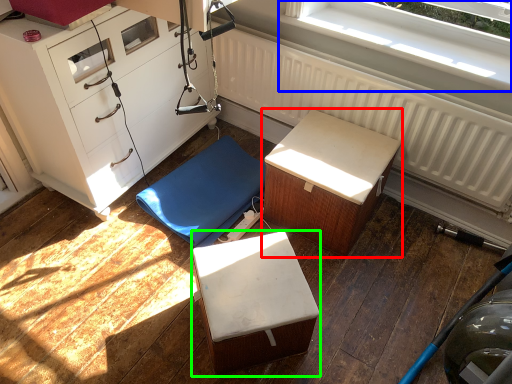
Question: Based on their relative distances, which object is farther from furniture (highlighted by a red box)? Choose from window (highlighted by a blue box) and furniture (highlighted by a green box).

Choices:
 (A) window
 (B) furniture

Answer: (A)